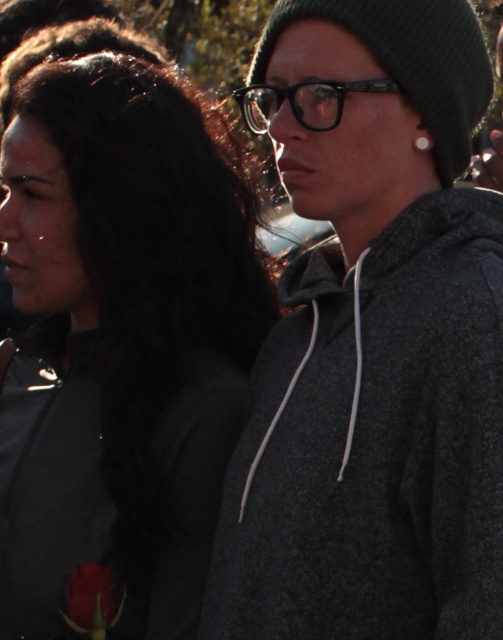
Question: Can you confirm if matte gray sweatshirt at left is smaller than silver metallic earring at upper center?

Choices:
 (A) yes
 (B) no

Answer: (B)

Question: Is matte gray sweatshirt at left bigger than matte red rose at lower left?

Choices:
 (A) yes
 (B) no

Answer: (A)

Question: Based on their relative distances, which object is farther from the silver metallic earring at upper center?

Choices:
 (A) dark gray fleece hoodie at right
 (B) matte gray sweatshirt at left
 (C) matte red rose at lower left
 (D) matte black hair at left

Answer: (C)

Question: Which object appears farthest from the camera in this image?

Choices:
 (A) matte red rose at lower left
 (B) matte gray sweatshirt at left
 (C) dark gray fleece hoodie at right
 (D) matte black hair at left

Answer: (D)

Question: Which of these objects is positioned closest to the silver metallic earring at upper center?

Choices:
 (A) matte gray sweatshirt at left
 (B) dark gray fleece hoodie at right
 (C) matte red rose at lower left

Answer: (B)

Question: Considering the relative positions of matte black hair at left and dark gray fleece hoodie at right in the image provided, where is matte black hair at left located with respect to dark gray fleece hoodie at right?

Choices:
 (A) right
 (B) left

Answer: (B)